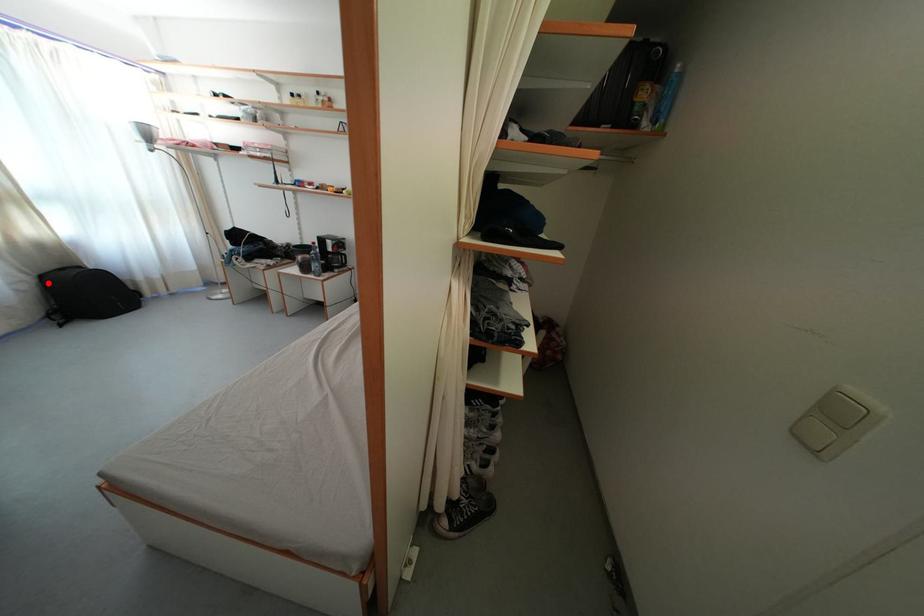
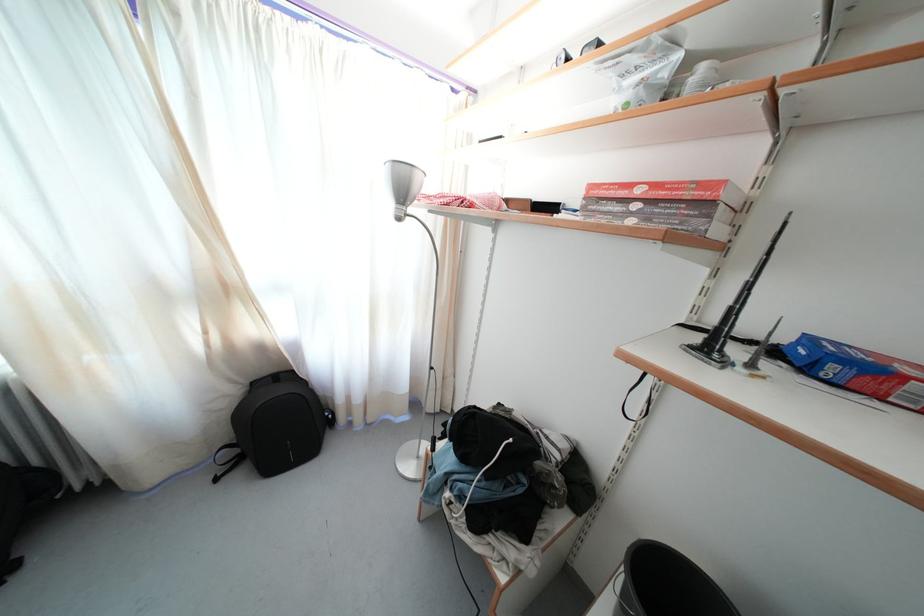
Question: I am providing you with two images of the same scene from different viewpoints. Given a red point in image1, look at the same physical point in image2. Is it:

Choices:
 (A) Closer to the viewpoint
 (B) Farther from the viewpoint

Answer: (A)